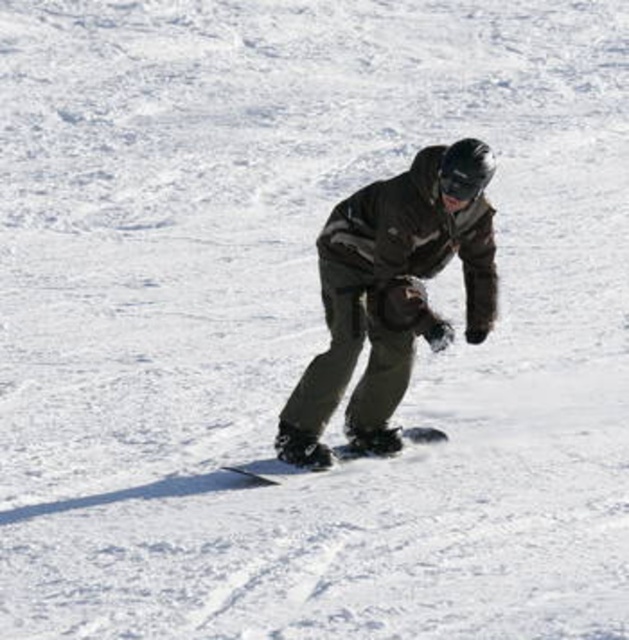
Question: Does black matte snowboard at center have a smaller size compared to black matte goggles at center?

Choices:
 (A) yes
 (B) no

Answer: (B)

Question: Which point is closer to the camera?

Choices:
 (A) (253, 470)
 (B) (452, 195)

Answer: (B)

Question: Can you confirm if black matte snowboard at center is bigger than black matte goggles at center?

Choices:
 (A) yes
 (B) no

Answer: (A)

Question: Can you confirm if black matte snowboard at center is wider than black matte goggles at center?

Choices:
 (A) no
 (B) yes

Answer: (B)

Question: Which point is closer to the camera taking this photo?

Choices:
 (A) (262, 481)
 (B) (448, 180)

Answer: (B)